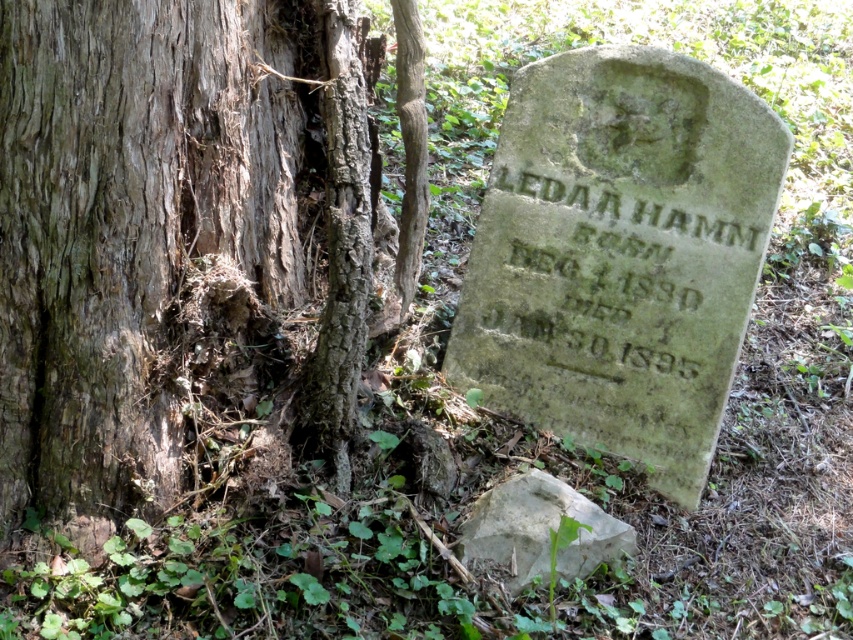
In the scene shown: You are a hiker who has stumbled upon this gravestone in the woods. You notice the brown rough bark tree trunk at left and the white rough rock at lower center. Which object is closer to you, the observer?

The white rough rock at lower center is closer to you because the brown rough bark tree trunk at left is positioned over it, indicating it is in front.

You are a photographer trying to capture the gravestone clearly. You notice the brown rough bark tree trunk at left and the white rough rock at lower center are blocking your view. Which object is wider and might be causing more obstruction?

The brown rough bark tree trunk at left is wider than the white rough rock at lower center, so it is causing more obstruction.

You are standing in front of the gravestone and want to take a photo that includes both the brown rough bark tree trunk at left and the white rough rock at lower center. Which object should you position closer to the left side of the frame to ensure both are visible?

You should position the brown rough bark tree trunk at left closer to the left side of the frame since it is already to the left of the white rough rock at lower center, ensuring both are visible in the photo.